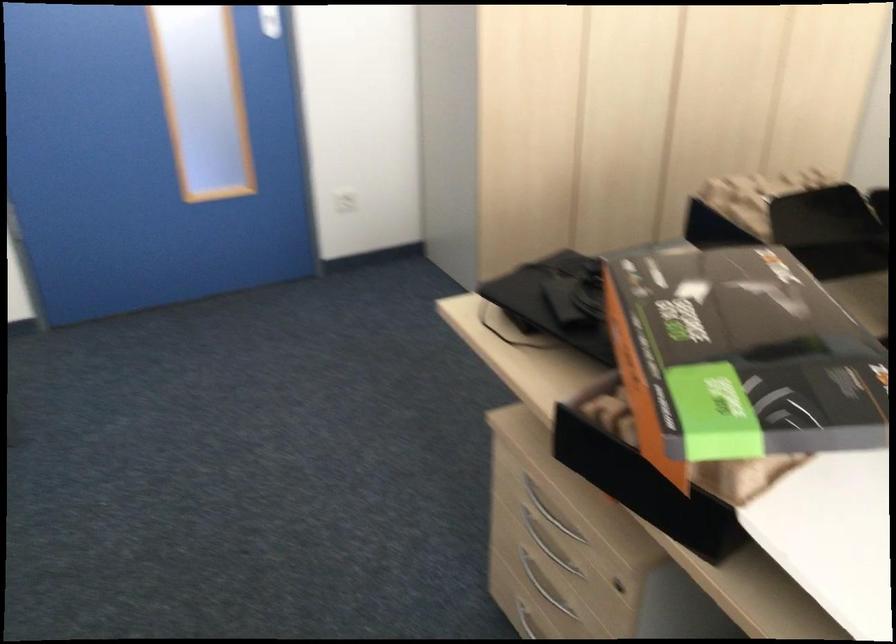
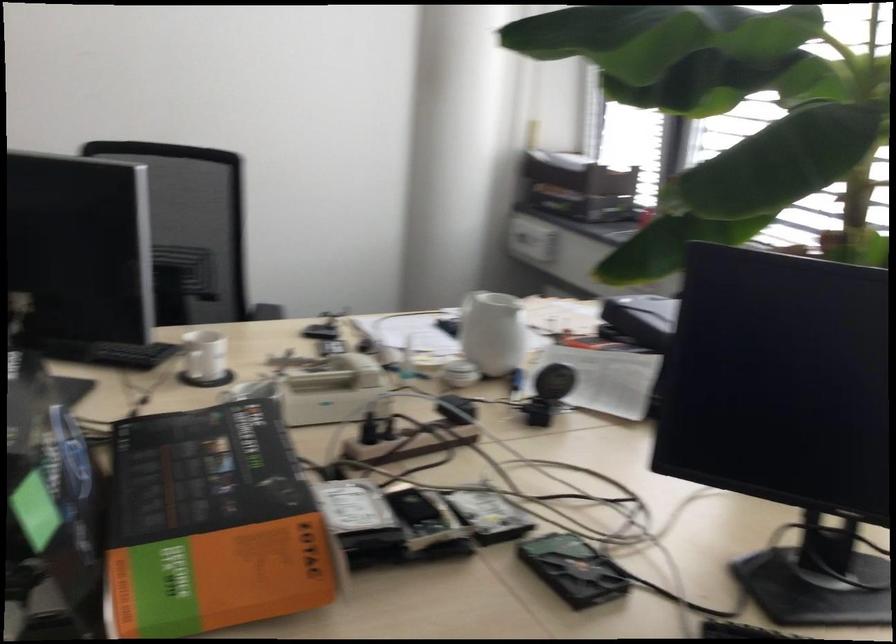
The first image is from the beginning of the video and the second image is from the end. How did the camera likely rotate when shooting the video?

The camera rotated toward right-down.